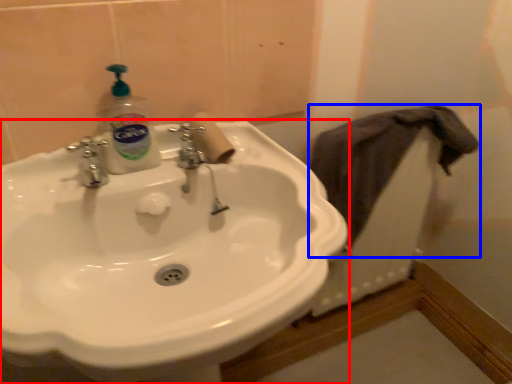
Question: Which of the following is the farthest to the observer, sink (highlighted by a red box) or bath towel (highlighted by a blue box)?

Choices:
 (A) sink
 (B) bath towel

Answer: (B)